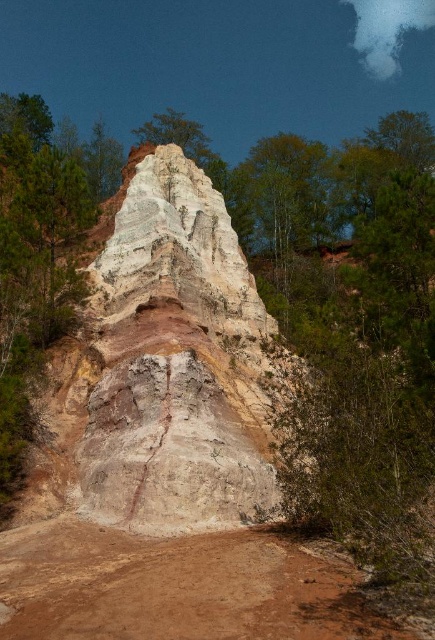
You are standing at the base of the cliff and want to take a photo of the point at coordinates point (181, 324). If your camera can focus up to 100 meters away, will you be able to capture that point clearly?

The point (181, 324) is 101.14 meters from the camera, which exceeds the camera focus limit of 100 meters. Therefore, the point cannot be captured clearly.

You are a geologist examining the image of the cliff formation. You notice the smooth sandstone rock at center. Based on its position, can you determine if it is closer to the top or bottom of the cliff?

The smooth sandstone rock at center is located at point coordinates approximately halfway between the top and bottom of the cliff, but slightly closer to the top. Therefore, it is positioned more toward the upper section of the cliff.

You are standing in front of the cliff and want to take a photo. You notice two points marked on the cliff surface. Which point is closer to your camera lens when you aim at the cliff? The points are point 1 at coordinates point (x=76, y=419) and point 2 at coordinates point (x=117, y=612).

Point 2 at coordinates point (x=117, y=612) is closer to the camera lens because it is less further to the camera than point 1 at coordinates point (x=76, y=419) according to the description.